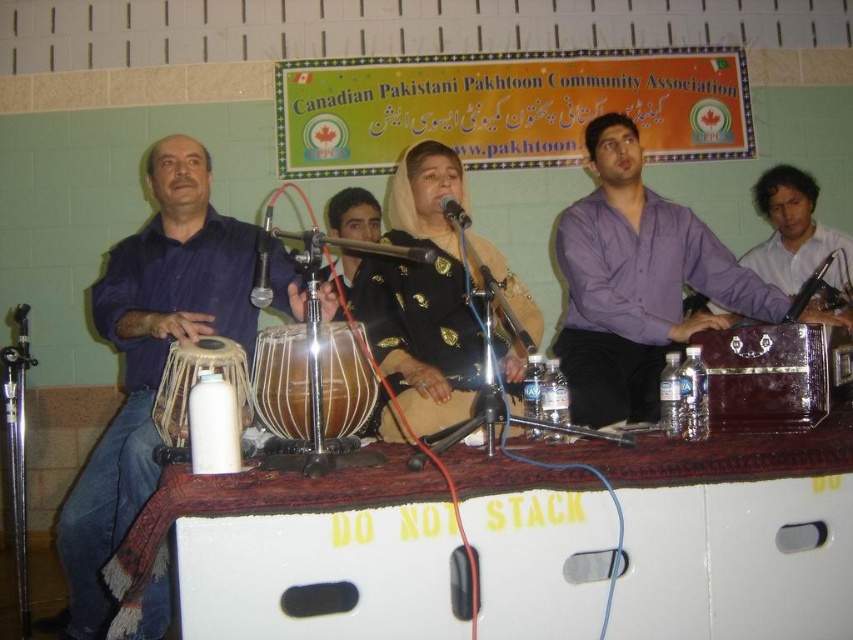
You are organizing a photo shoot and need to decide which item to use as a backdrop. The blue fabric at left and the black satin dress at center are available. Which one is larger and thus more suitable for covering the entire background?

The blue fabric at left is bigger than the black satin dress at center, so it is more suitable for covering the entire background.